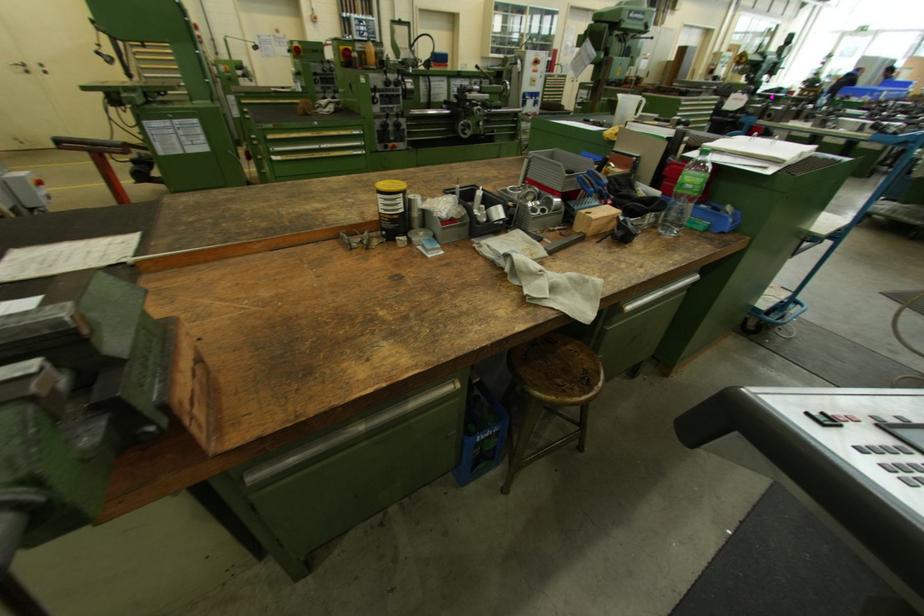
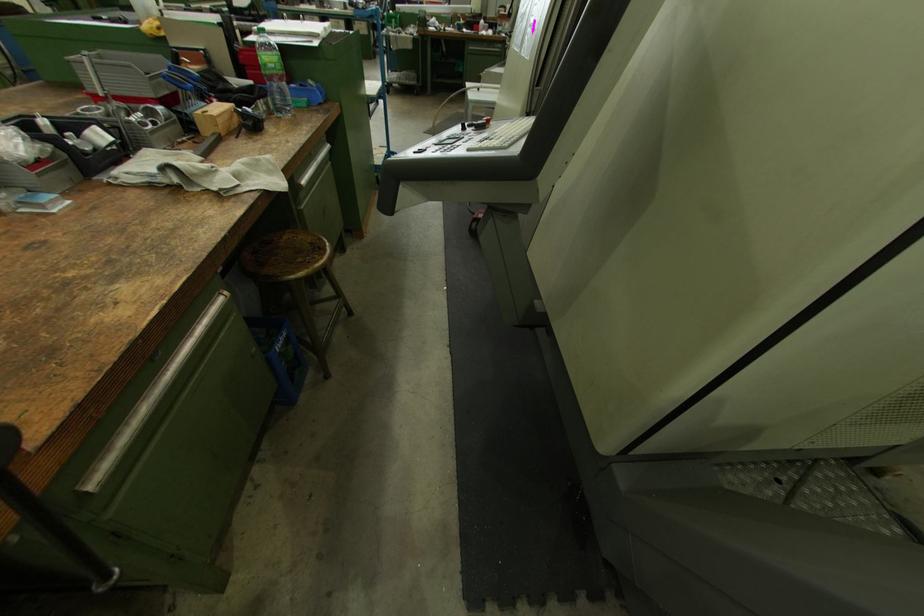
The point at (687, 185) is marked in the first image. Where is the corresponding point in the second image?

(271, 66)